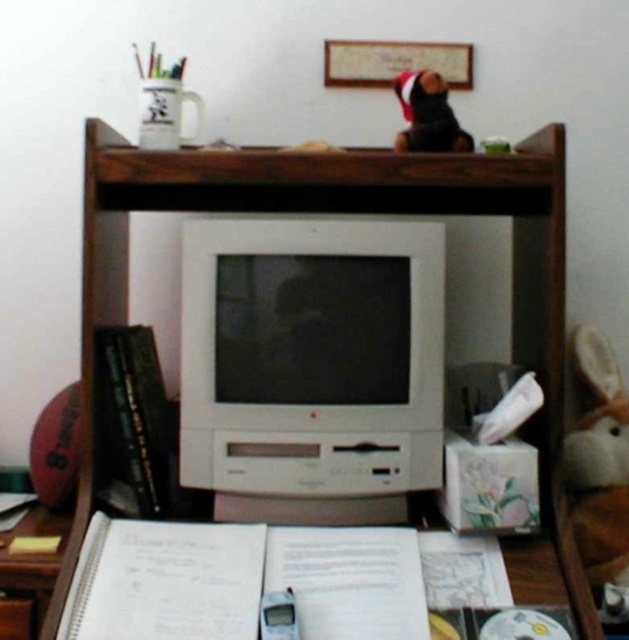
Question: Which point is closer to the camera?

Choices:
 (A) white plastic computer desk at center
 (B) white plastic monitor at center

Answer: (A)

Question: Can you confirm if white plastic monitor at center is positioned above wooden drawer at lower left?

Choices:
 (A) yes
 (B) no

Answer: (A)

Question: Which object is positioned closest to the white plastic monitor at center?

Choices:
 (A) wooden drawer at lower left
 (B) white plastic computer desk at center

Answer: (B)

Question: Is white plastic monitor at center bigger than white plastic computer desk at center?

Choices:
 (A) no
 (B) yes

Answer: (A)

Question: Among these objects, which one is nearest to the camera?

Choices:
 (A) wooden drawer at lower left
 (B) white plastic monitor at center
 (C) white plastic computer desk at center

Answer: (C)

Question: Where is white plastic monitor at center located in relation to white plastic computer desk at center in the image?

Choices:
 (A) left
 (B) right

Answer: (A)